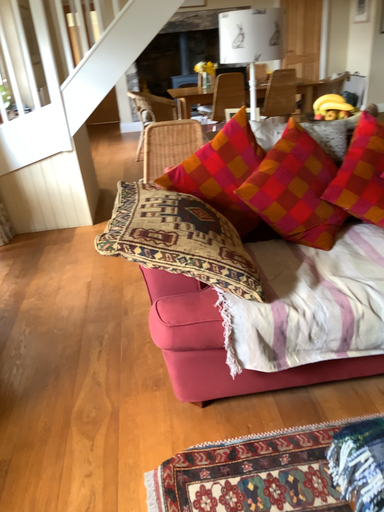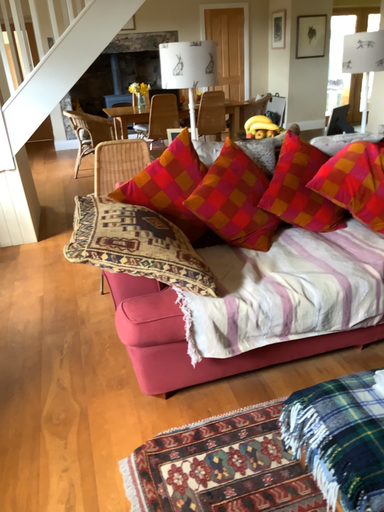
Question: How did the camera likely rotate when shooting the video?

Choices:
 (A) rotated right
 (B) rotated left

Answer: (A)